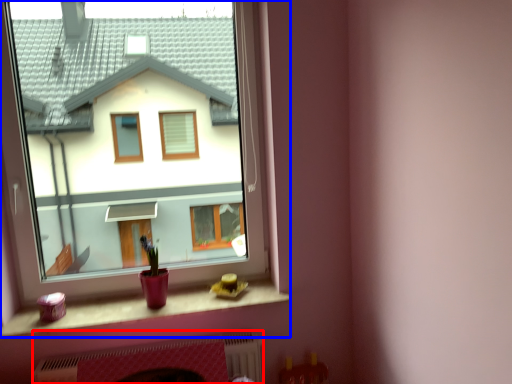
Question: Which point is further to the camera, fireplace (highlighted by a red box) or window (highlighted by a blue box)?

Choices:
 (A) fireplace
 (B) window

Answer: (A)